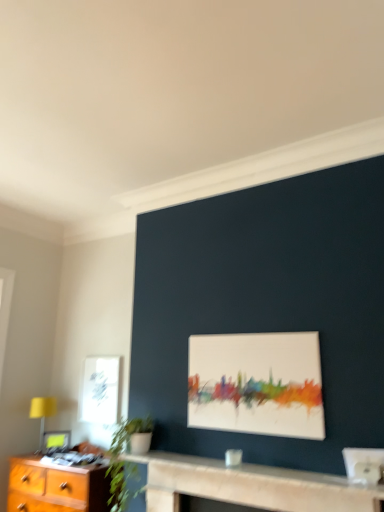
Question: Would you say white matte painting at center, arranged as the 2th picture frame when viewed from the back, contains smooth stone fireplace at center?

Choices:
 (A) no
 (B) yes

Answer: (A)

Question: From a real-world perspective, is white matte painting at center, arranged as the 2th picture frame when viewed from the back, positioned under smooth stone fireplace at center based on gravity?

Choices:
 (A) no
 (B) yes

Answer: (A)

Question: Is white matte painting at center, arranged as the 2th picture frame when ordered from the bottom, completely or partially outside of smooth stone fireplace at center?

Choices:
 (A) yes
 (B) no

Answer: (A)

Question: Is white matte painting at center, marked as the 1th picture frame in a right-to-left arrangement, positioned far away from smooth stone fireplace at center?

Choices:
 (A) no
 (B) yes

Answer: (A)

Question: From a real-world perspective, does white matte painting at center, positioned as the 1th picture frame in front-to-back order, stand above smooth stone fireplace at center?

Choices:
 (A) no
 (B) yes

Answer: (B)

Question: Is white matte painting at center, arranged as the 2th picture frame when viewed from the back, positioned before smooth stone fireplace at center?

Choices:
 (A) yes
 (B) no

Answer: (B)

Question: Is white paper at upper left aimed at smooth stone fireplace at center?

Choices:
 (A) yes
 (B) no

Answer: (B)

Question: Is smooth stone fireplace at center inside white paper at upper left?

Choices:
 (A) no
 (B) yes

Answer: (A)

Question: From the image's perspective, would you say white paper at upper left is positioned over smooth stone fireplace at center?

Choices:
 (A) no
 (B) yes

Answer: (B)

Question: Considering the relative sizes of white paper at upper left and smooth stone fireplace at center in the image provided, is white paper at upper left wider than smooth stone fireplace at center?

Choices:
 (A) yes
 (B) no

Answer: (B)

Question: From the image's perspective, is white paper at upper left beneath smooth stone fireplace at center?

Choices:
 (A) no
 (B) yes

Answer: (A)

Question: Does white paper at upper left come in front of smooth stone fireplace at center?

Choices:
 (A) no
 (B) yes

Answer: (A)

Question: Does smooth stone fireplace at center have a lesser height compared to white matte painting at center, arranged as the first picture frame when viewed from the top?

Choices:
 (A) yes
 (B) no

Answer: (A)